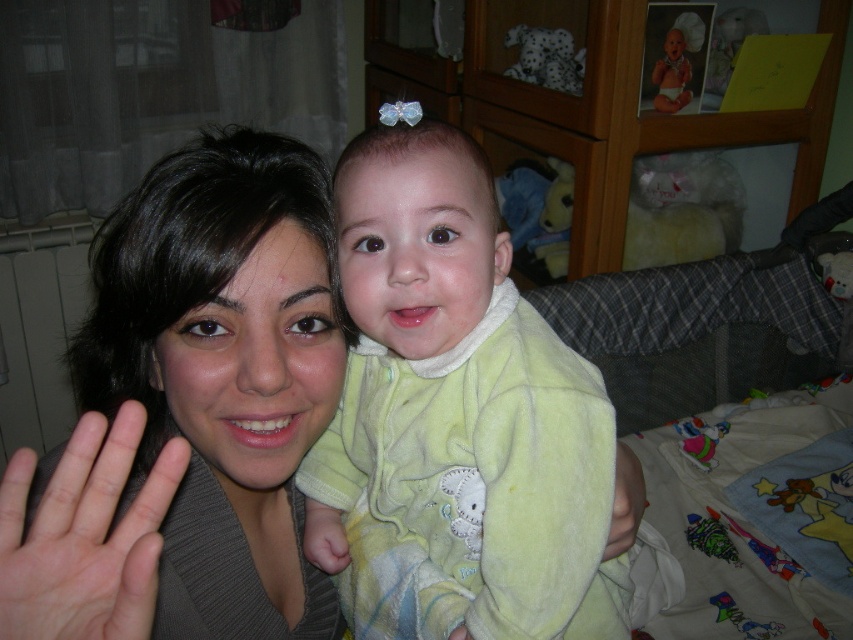
Question: Can you confirm if matte gray sweater at center is bigger than pale skin/soft flesh at center?

Choices:
 (A) no
 (B) yes

Answer: (B)

Question: Which object appears farthest from the camera in this image?

Choices:
 (A) pale skin/soft flesh at center
 (B) matte gray sweater at center

Answer: (B)

Question: Does light green fleece onesie at center lie behind matte gray sweater at center?

Choices:
 (A) yes
 (B) no

Answer: (A)

Question: Which point appears farthest from the camera in this image?

Choices:
 (A) (277, 230)
 (B) (36, 628)

Answer: (A)

Question: Which point is farther from the camera taking this photo?

Choices:
 (A) (294, 598)
 (B) (521, 554)
 (C) (51, 557)

Answer: (A)

Question: Is matte gray sweater at center closer to camera compared to pale skin/soft flesh at center?

Choices:
 (A) no
 (B) yes

Answer: (A)